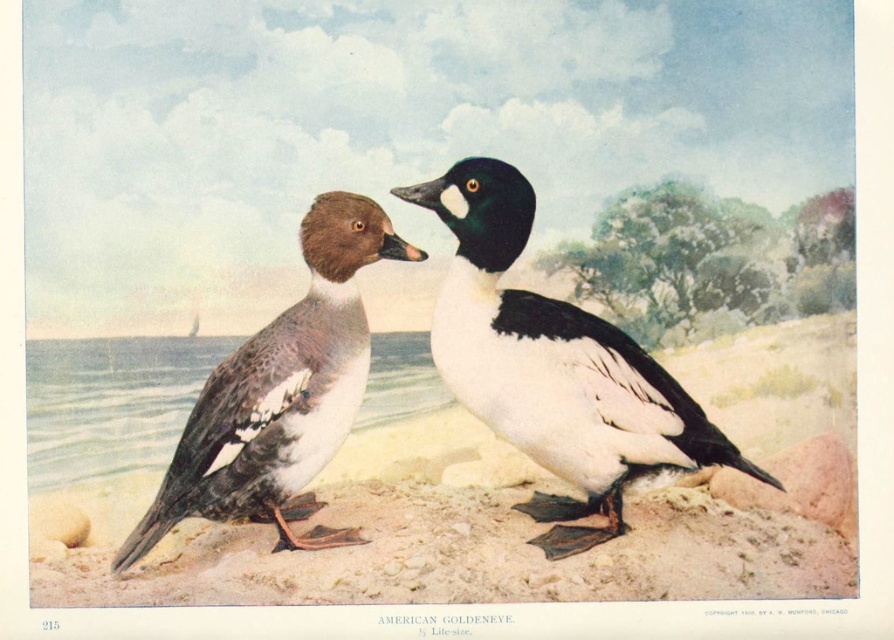
Question: Does smooth sand at lower center come in front of smooth gray water at lower left?

Choices:
 (A) no
 (B) yes

Answer: (B)

Question: Which of the following is the farthest from the observer?

Choices:
 (A) (66, 465)
 (B) (235, 436)
 (C) (586, 460)
 (D) (209, 566)

Answer: (A)

Question: Which object is positioned farthest from the white matte duck at center?

Choices:
 (A) brown speckled feathers at center
 (B) smooth sand at lower center
 (C) smooth gray water at lower left

Answer: (C)

Question: Is smooth sand at lower center to the left of white matte duck at center from the viewer's perspective?

Choices:
 (A) no
 (B) yes

Answer: (B)

Question: Which point is farther from the camera taking this photo?

Choices:
 (A) (43, 429)
 (B) (629, 564)

Answer: (A)

Question: Considering the relative positions of smooth sand at lower center and brown speckled feathers at center in the image provided, where is smooth sand at lower center located with respect to brown speckled feathers at center?

Choices:
 (A) below
 (B) above

Answer: (A)